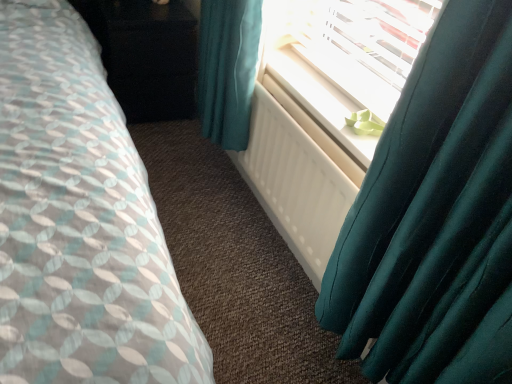
What are the coordinates of `free space above white plastic radiator at upper center (from a real-world perspective)` in the screenshot? It's located at (317, 93).